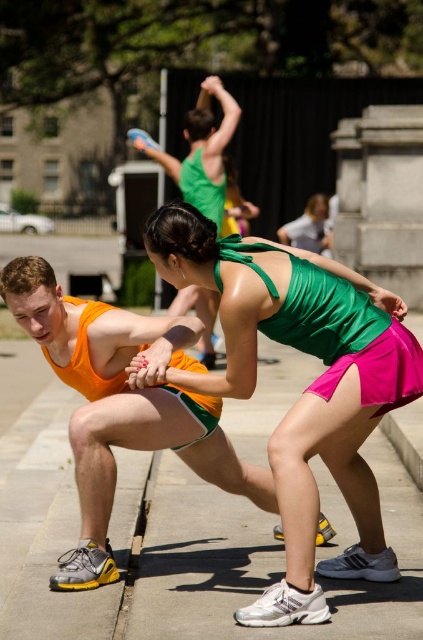
Is green satin tank top at center to the left of concrete at lower right from the viewer's perspective?

Yes, green satin tank top at center is to the left of concrete at lower right.

Which of these two, green satin tank top at center or concrete at lower right, stands taller?

green satin tank top at center

Locate an element on the screen. Image resolution: width=423 pixels, height=640 pixels. green satin tank top at center is located at coordinates (302, 392).

The height and width of the screenshot is (640, 423). In order to click on green satin tank top at center in this screenshot , I will do `click(302, 392)`.

Is orange matte tank top at left smaller than concrete at lower right?

Actually, orange matte tank top at left might be larger than concrete at lower right.

Measure the distance between orange matte tank top at left and camera.

A distance of 5.75 meters exists between orange matte tank top at left and camera.

Where is `orange matte tank top at left`? Image resolution: width=423 pixels, height=640 pixels. orange matte tank top at left is located at coordinates [117, 410].

Is point (359, 403) positioned in front of point (200, 401)?

That is True.

You are a GUI agent. You are given a task and a screenshot of the screen. Output one action in this format:
    pyautogui.click(x=<x>, y=<y>)
    Task: Click on the green satin tank top at center
    
    Given the screenshot: What is the action you would take?
    pyautogui.click(x=302, y=392)